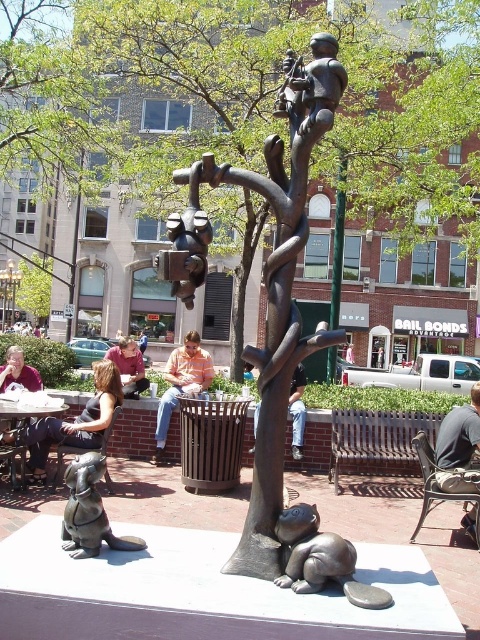
You are a maintenance worker who needs to clean both the bronze tree at center and the bronze statue of dog at lower left. You have a 1 meter long cleaning rod. Can you reach both objects from your current position without moving closer? Please explain your reasoning.

The bronze tree at center and bronze statue of dog at lower left are 89.97 centimeters apart from each other. Since the distance between them is less than 1 meter, the 1 meter long cleaning rod can reach both objects from the same position if they are within the rod length. However, the exact positioning depends on their locations relative to the worker. If the worker is positioned such that both are within the rod length from their current spot, then yes. But if one is beyond the rod length, then no. The 8

You are standing in the plaza and want to take a photo of the bronze tree at center. If your camera can focus on objects up to 7 feet away, will you need to move closer or farther away to get a clear shot?

The bronze tree at center is 7.19 feet away from the camera, which is slightly beyond the camera focus range of 7 feet. To get a clear shot, you need to move closer to reduce the distance between you and the bronze tree at center.

You are a visitor in the plaza and want to take a photo that includes both the bronze tree at center and the bronze statue of dog at lower left. Which object should you position closer to the camera to ensure both are fully visible in the frame?

Since the bronze tree at center is taller than the bronze statue of dog at lower left, you should position the bronze statue of dog at lower left closer to the camera to ensure both are fully visible in the frame.